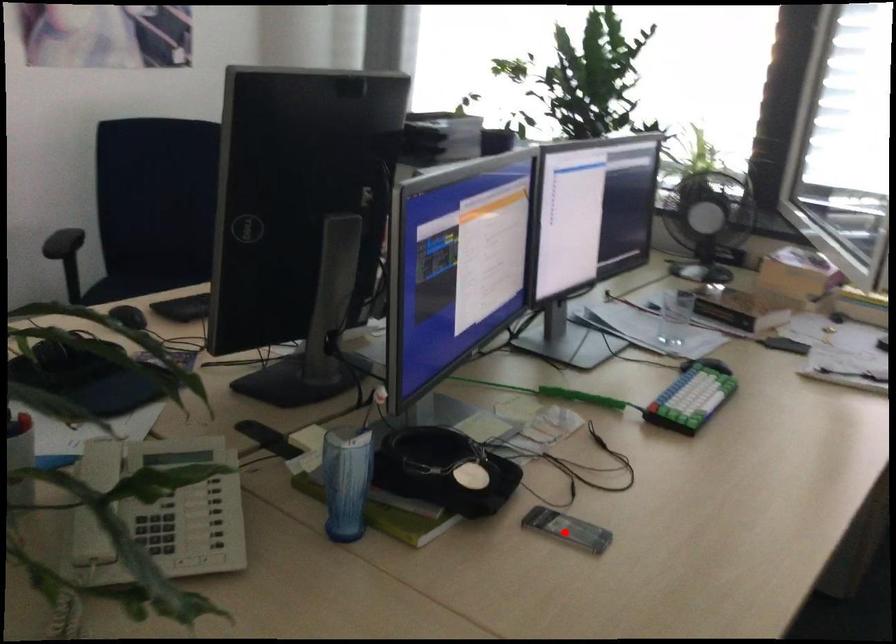
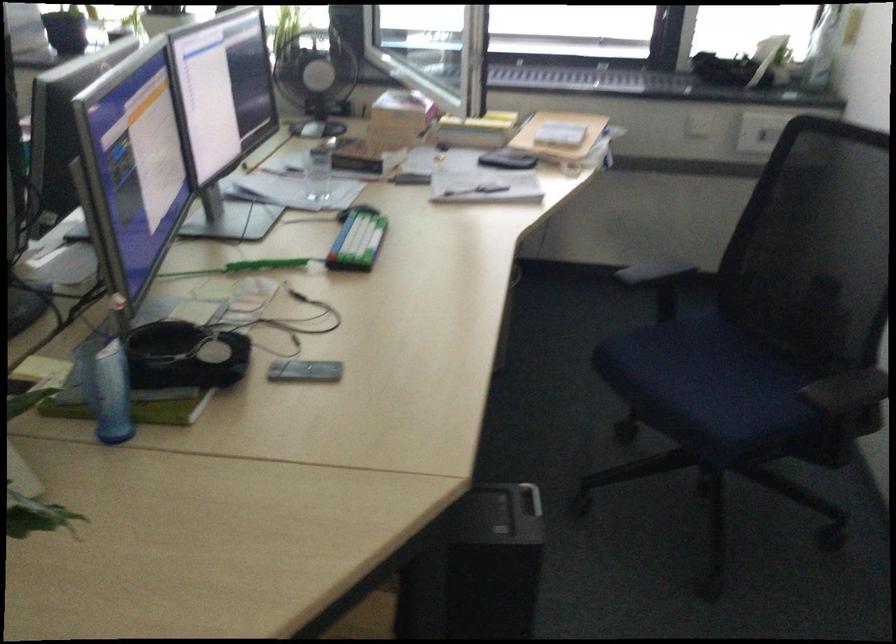
Question: A red point is marked in image1. In image2, is the corresponding 3D point closer to the camera or farther? Reply with the corresponding letter.

Choices:
 (A) The corresponding 3D point is closer.
 (B) The corresponding 3D point is farther.

Answer: (B)